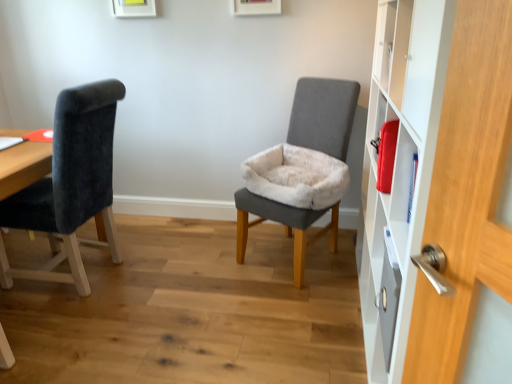
This screenshot has height=384, width=512. What are the coordinates of `vacant area to the left of gray fabric chair at center, which is the 2th chair from left to right` in the screenshot? It's located at (209, 260).